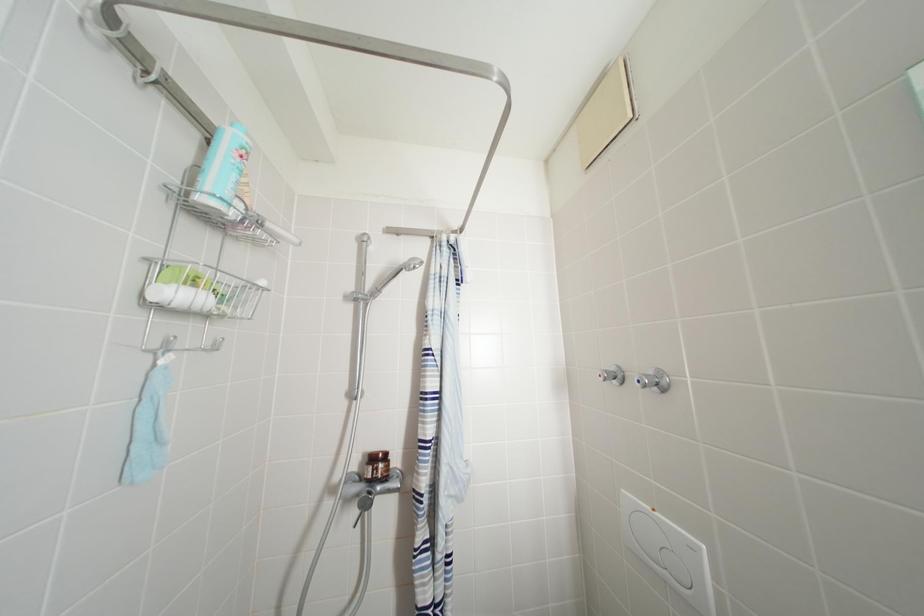
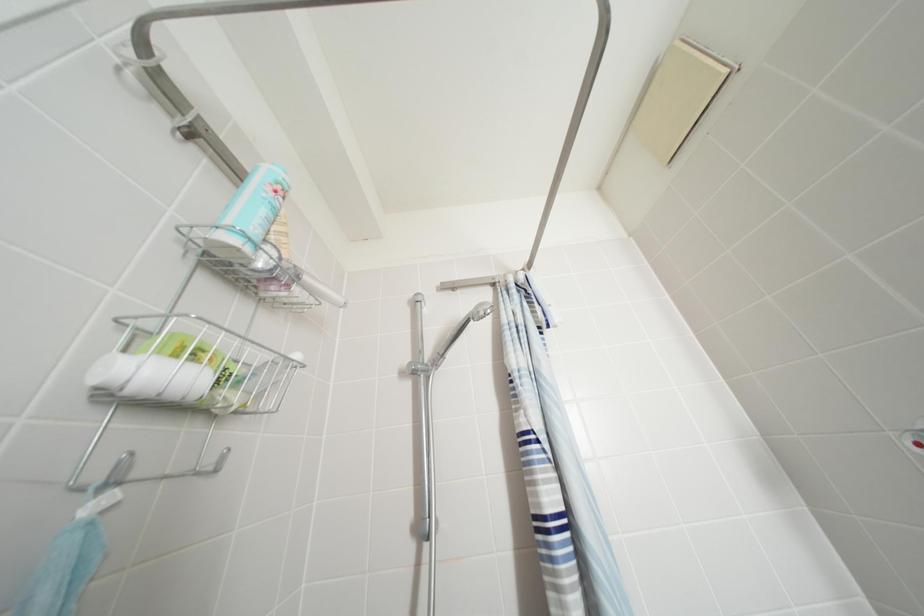
The images are taken continuously from a first-person perspective. In which direction are you moving?

The cameraman walked toward left, forward.